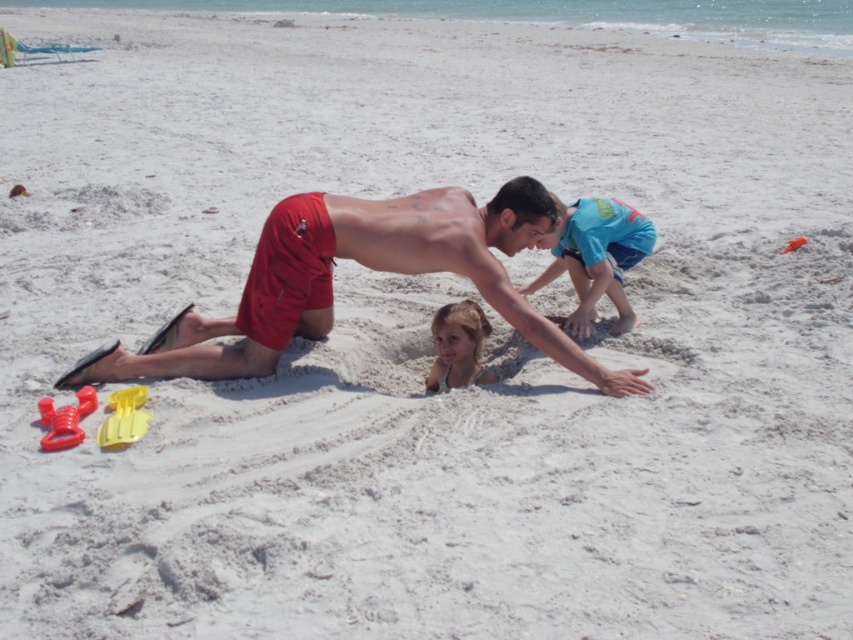
You are a photographer standing at the beach scene. You want to take a photo that includes both the point at coordinates (457, 246) and the point at (439, 364). Which of these two points should you focus on first to ensure both are in sharp focus?

You should focus on the point at coordinates (457, 246) first because it is closer to you than the point at (439, 364). By focusing on the closer point, the farther point will also be in focus due to the depth of field.

You are standing at the edge of the beach and see the red shorts at center and the orange plastic shovel at center. If you want to pick up the shovel first, can you reach it without moving from your current position?

The red shorts at center is 3.36 meters away from orange plastic shovel at center. Since the distance is more than arm length, you cannot reach the orange plastic shovel at center without moving closer.